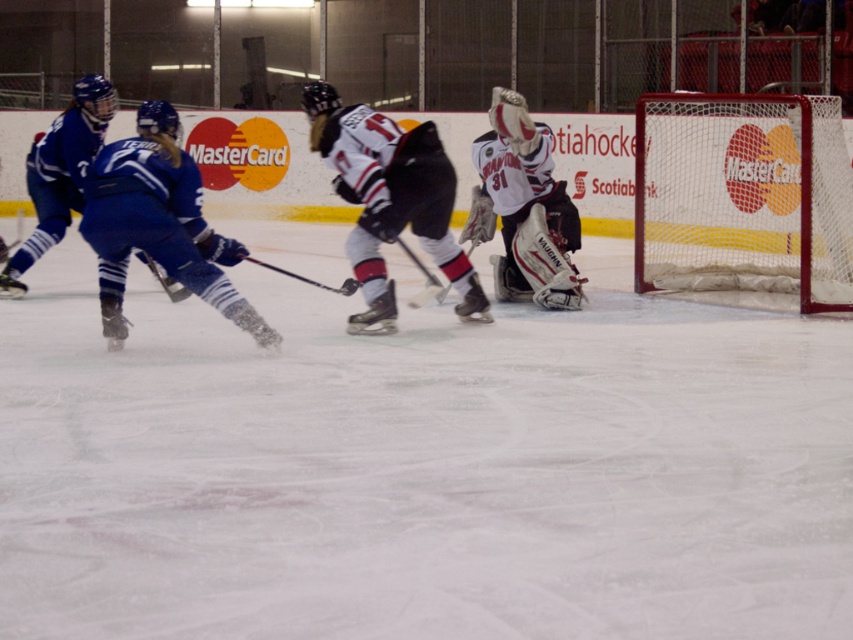
You are a referee observing an ice hockey game. You notice two hockey sticks on the ice. The matte black hockey stick at left and the metallic silver hockey stick at center. Which hockey stick is taller?

The matte black hockey stick at left is taller than the metallic silver hockey stick at center.

You are a referee in an ice hockey game and need to determine which of the two points, point (167, 284) or point (299, 276), is closer to you. Based on the scene, which point is nearer?

Point (167, 284) is closer to you because it is further to the viewer than point (299, 276).

You are an ice hockey player trying to grab a hockey stick. You are standing at the center of the rink. Which hockey stick is closer to you, the matte black hockey stick at left or the metallic silver hockey stick at center?

The metallic silver hockey stick at center is closer to you since it is positioned at the center of the rink, while the matte black hockey stick at left is located further away on the left side.